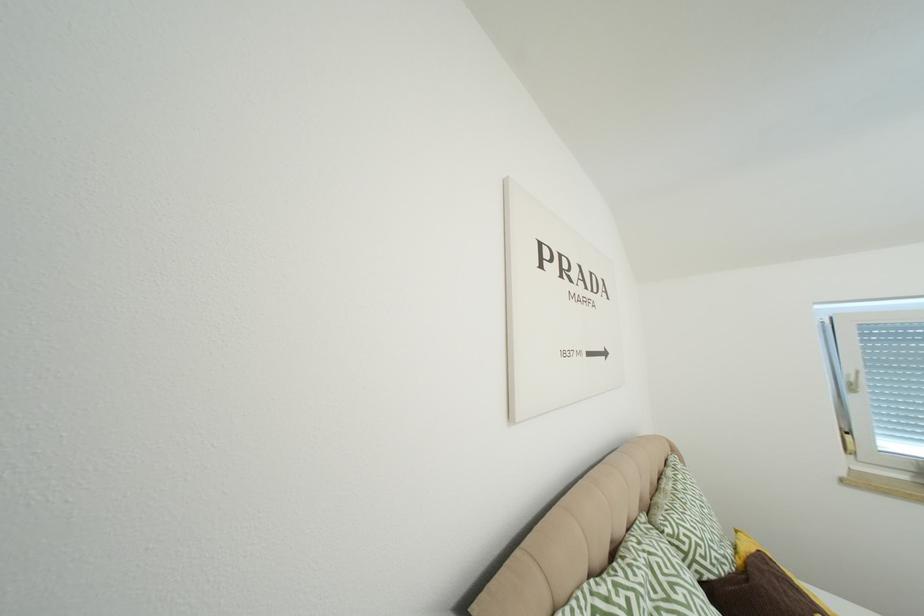
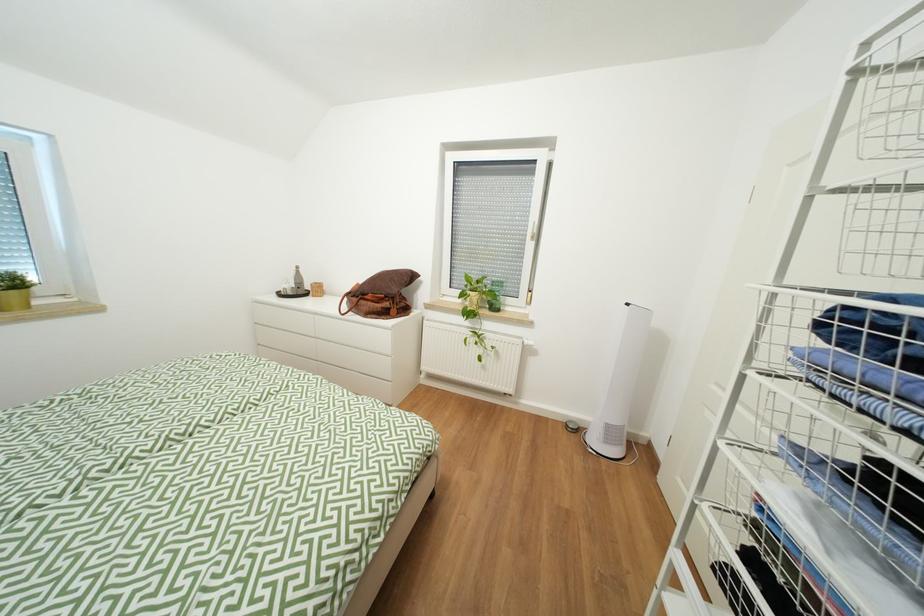
Question: The camera is either moving clockwise (left) or counter-clockwise (right) around the object. The first image is from the beginning of the video and the second image is from the end. Is the camera moving left or right when shooting the video?

Choices:
 (A) Left
 (B) Right

Answer: (A)